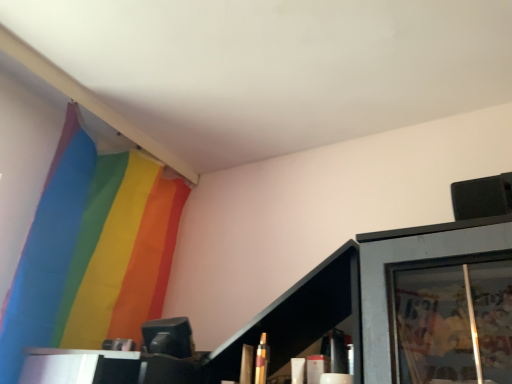
Question: Is matte black cabinet at lower right looking in the opposite direction of rainbow fabric flag at upper left?

Choices:
 (A) no
 (B) yes

Answer: (A)

Question: Is matte black cabinet at lower right bigger than rainbow fabric flag at upper left?

Choices:
 (A) no
 (B) yes

Answer: (A)

Question: Can you confirm if matte black cabinet at lower right is taller than rainbow fabric flag at upper left?

Choices:
 (A) no
 (B) yes

Answer: (A)

Question: From a real-world perspective, is matte black cabinet at lower right under rainbow fabric flag at upper left?

Choices:
 (A) no
 (B) yes

Answer: (B)

Question: From the image's perspective, is matte black cabinet at lower right beneath rainbow fabric flag at upper left?

Choices:
 (A) yes
 (B) no

Answer: (A)

Question: Is matte black cabinet at lower right further to camera compared to rainbow fabric flag at upper left?

Choices:
 (A) yes
 (B) no

Answer: (B)

Question: From a real-world perspective, is rainbow fabric flag at upper left positioned over matte black cabinet at lower right based on gravity?

Choices:
 (A) no
 (B) yes

Answer: (B)

Question: Is rainbow fabric flag at upper left positioned far away from matte black cabinet at lower right?

Choices:
 (A) yes
 (B) no

Answer: (B)

Question: Is matte black cabinet at lower right inside rainbow fabric flag at upper left?

Choices:
 (A) no
 (B) yes

Answer: (A)

Question: Considering the relative sizes of rainbow fabric flag at upper left and matte black cabinet at lower right in the image provided, is rainbow fabric flag at upper left shorter than matte black cabinet at lower right?

Choices:
 (A) yes
 (B) no

Answer: (B)

Question: Can you confirm if rainbow fabric flag at upper left is taller than matte black cabinet at lower right?

Choices:
 (A) yes
 (B) no

Answer: (A)

Question: From a real-world perspective, is rainbow fabric flag at upper left located beneath matte black cabinet at lower right?

Choices:
 (A) no
 (B) yes

Answer: (A)

Question: From a real-world perspective, is matte black cabinet at lower right positioned above or below rainbow fabric flag at upper left?

Choices:
 (A) above
 (B) below

Answer: (B)